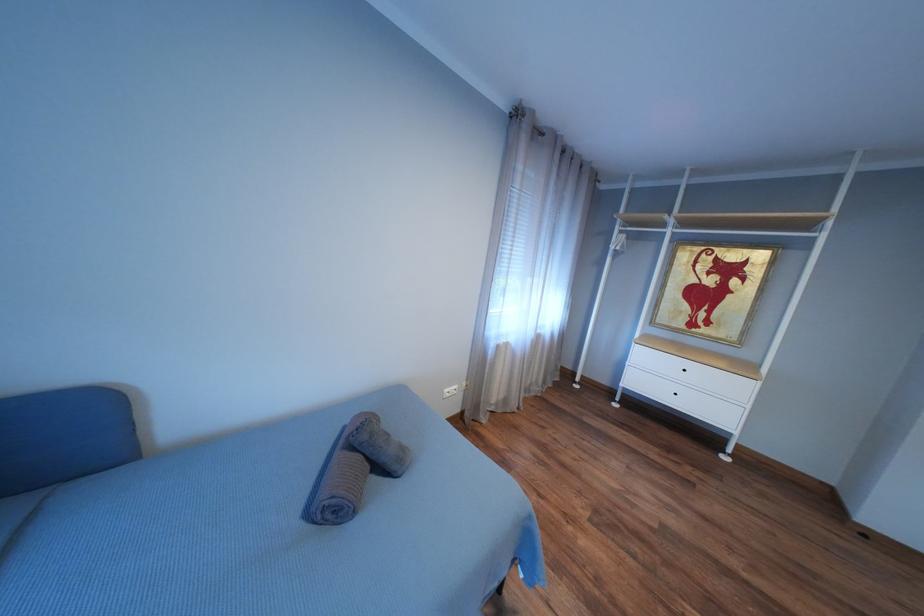
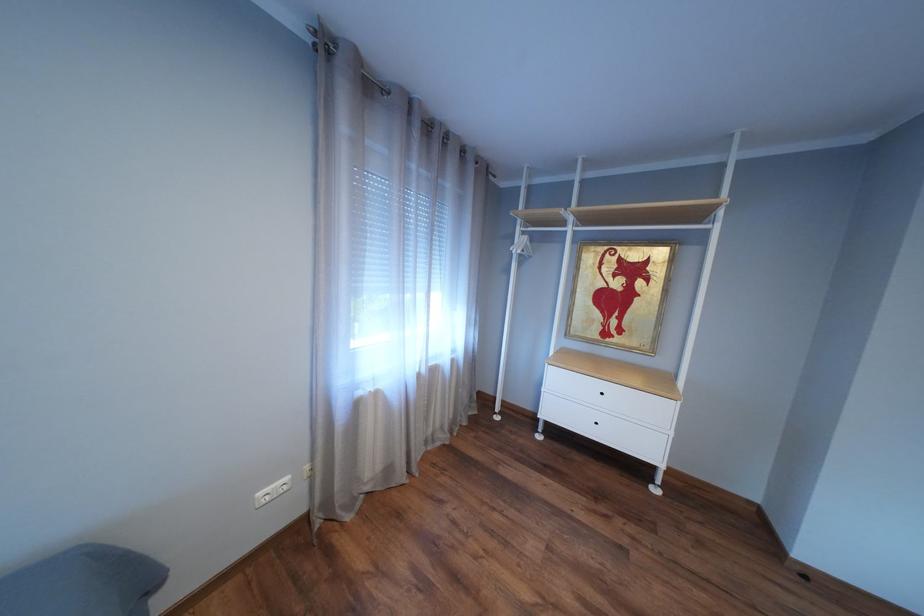
Question: The images are taken continuously from a first-person perspective. In which direction is your viewpoint rotating?

Choices:
 (A) Left
 (B) Right
 (C) Up
 (D) Down

Answer: (B)